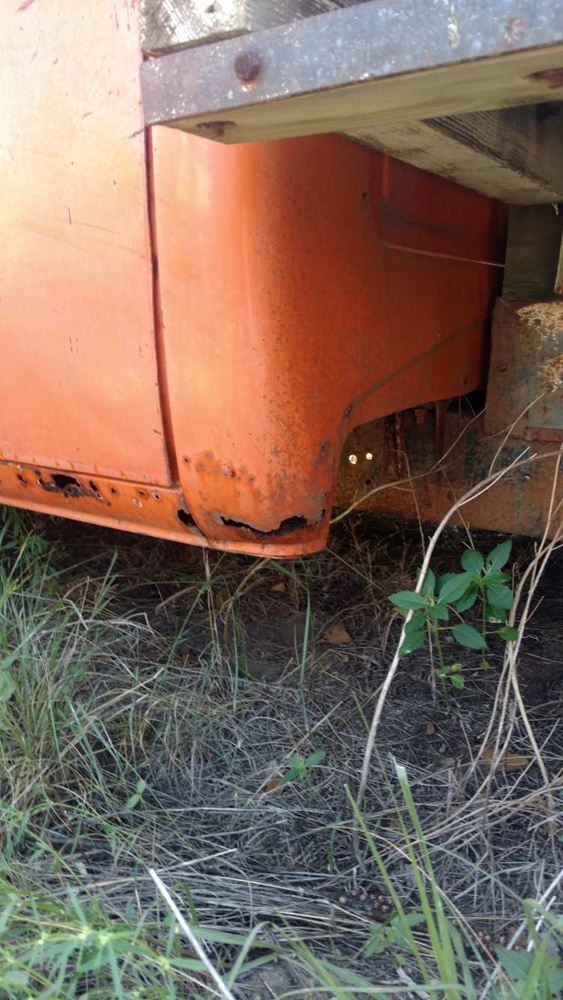
Where is `wooden beam`? This screenshot has height=1000, width=563. wooden beam is located at coordinates (338, 94).